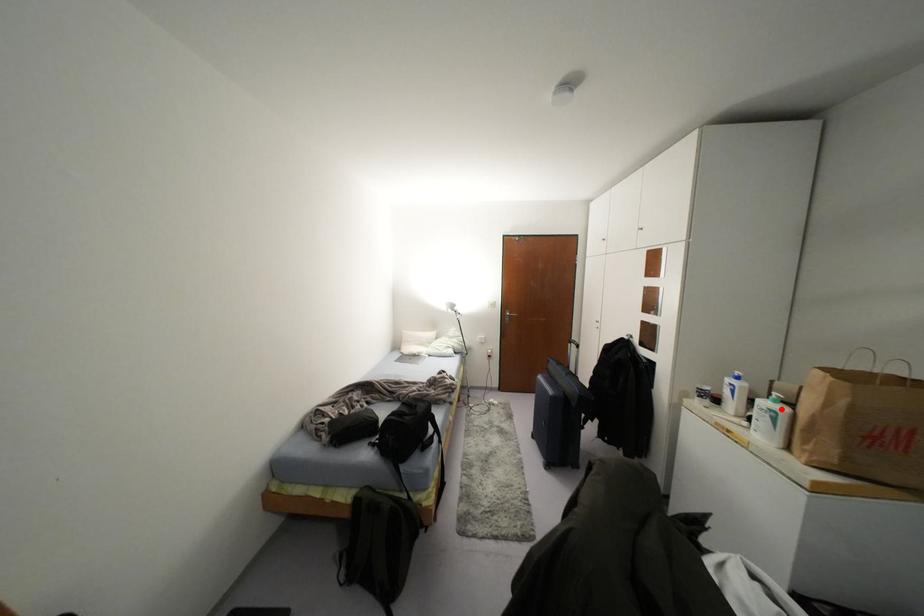
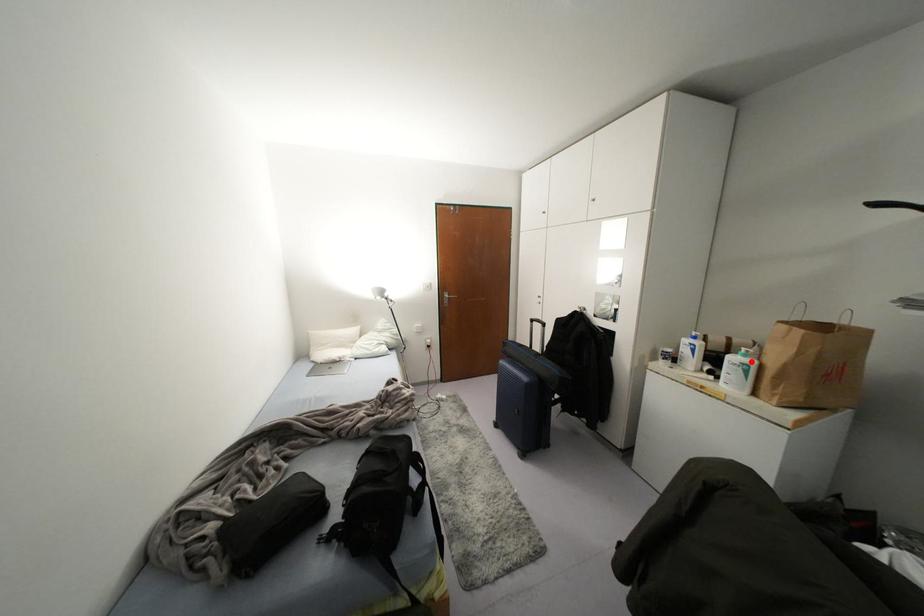
I am providing you with two images of the same scene from different viewpoints. A red point is marked on the first image and another point is marked on the second image. Is the marked point in image1 the same physical position as the marked point in image2?

Yes